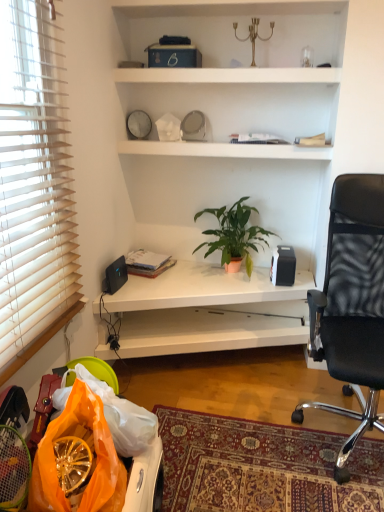
Where is `vacant space that's between black plastic speaker at lower left, which is the second loudspeaker from right to left, and green matte plant at center`? vacant space that's between black plastic speaker at lower left, which is the second loudspeaker from right to left, and green matte plant at center is located at coordinates (168, 286).